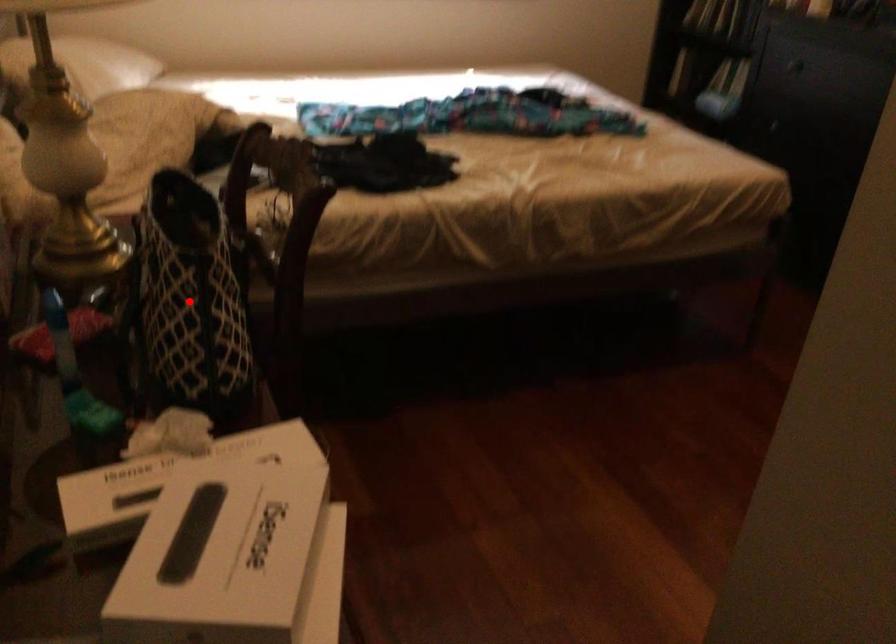
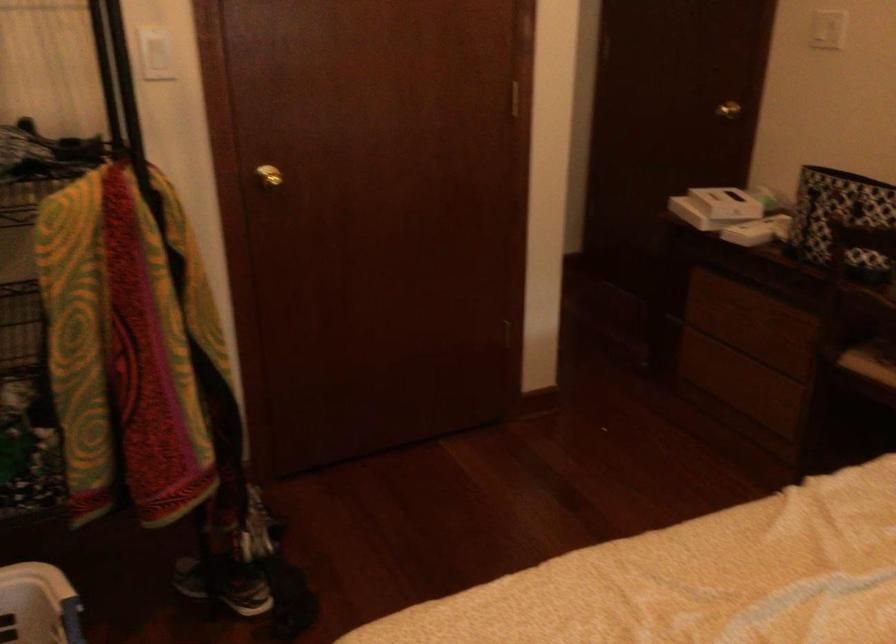
Question: I am providing you with two images of the same scene from different viewpoints. A red point is marked on the first image. Is the red point's position out of view in image 2?

Choices:
 (A) Yes
 (B) No

Answer: (A)